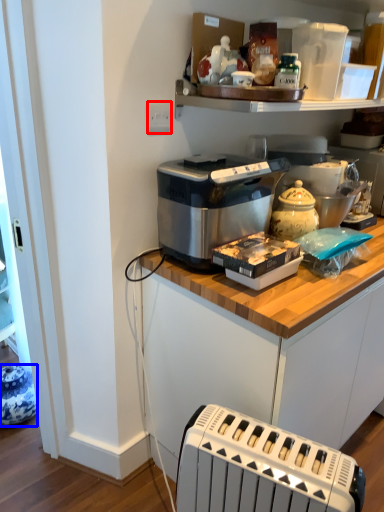
Question: Which object is closer to the camera taking this photo, electric outlet (highlighted by a red box) or appliance (highlighted by a blue box)?

Choices:
 (A) electric outlet
 (B) appliance

Answer: (A)